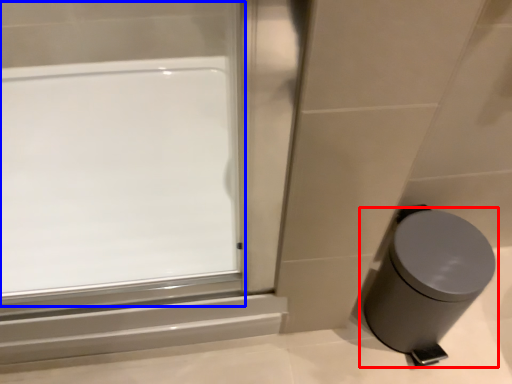
Question: Which object is closer to the camera taking this photo, waste container (highlighted by a red box) or window (highlighted by a blue box)?

Choices:
 (A) waste container
 (B) window

Answer: (A)